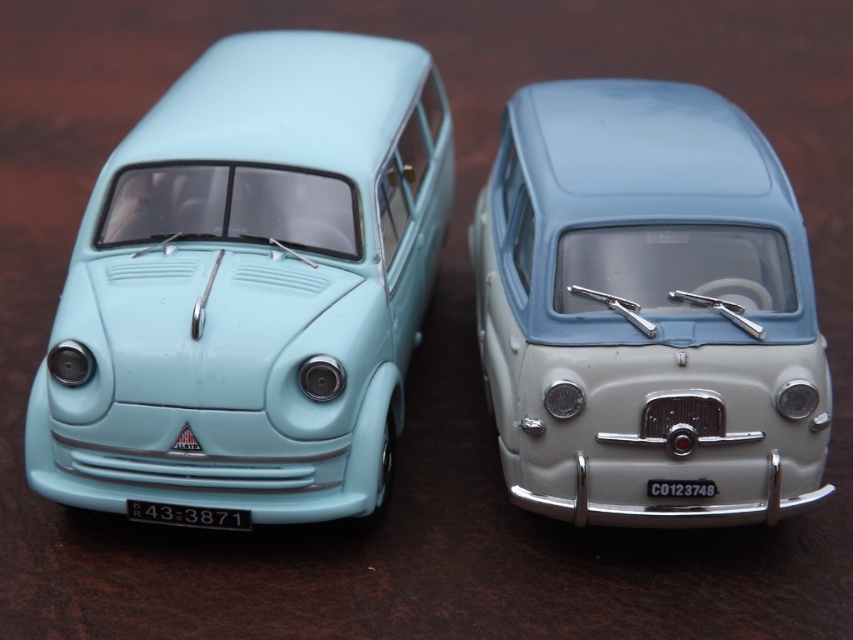
You are a delivery driver who needs to load packages into the van. You see the matte light blue van at left and the light blue matte van at center. Which van should you choose if you want to load packages from the loading dock that is at ground level?

The light blue matte van at center should be chosen because the matte light blue van at left is located above it, making the light blue matte van at center accessible from ground level.

Consider the image. You are a photographer setting up a shoot with two light blue matte vans. You want to ensure the matte light blue van at left is visible in the frame. Given that the light blue matte van at center is blocking part of its view, where should you position yourself relative to the vans to capture both?

Position yourself behind the light blue matte van at center so that the matte light blue van at left, which is in front, becomes visible while still including the van at center in the frame.